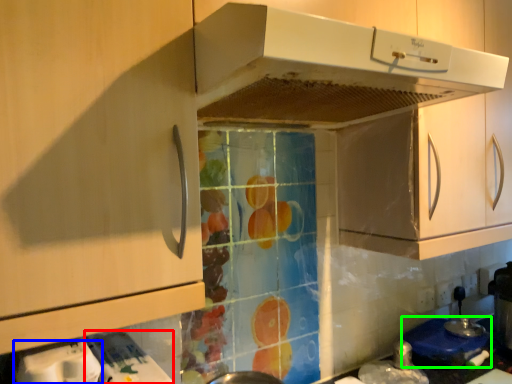
Question: Considering the real-world distances, which object is farthest from appliance (highlighted by a red box)? appliance (highlighted by a blue box) or appliance (highlighted by a green box)?

Choices:
 (A) appliance
 (B) appliance

Answer: (B)